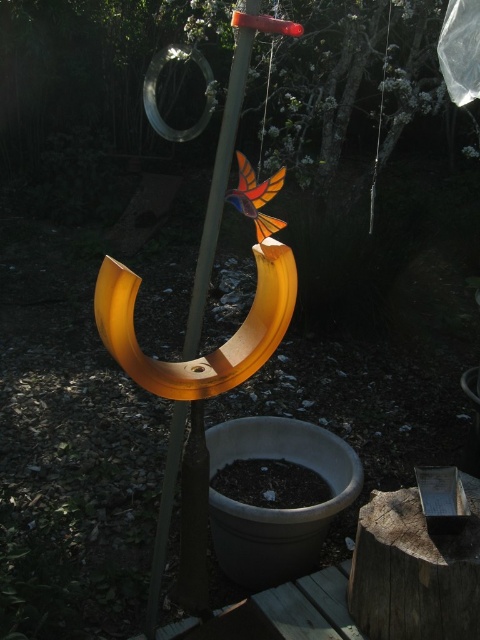
You are standing in front of the outdoor hanging decoration and want to touch both points. Which point should you reach for first, point (90, 72) or point (222, 195)?

You should reach for point (90, 72) first because it is closer to you than point (222, 195).

You are an observer standing in front of the hanging decoration. You notice the transparent plastic bird at center and the translucent plastic pole at center. Which object is closer to you?

The transparent plastic bird at center is closer to you because the translucent plastic pole at center is behind it.